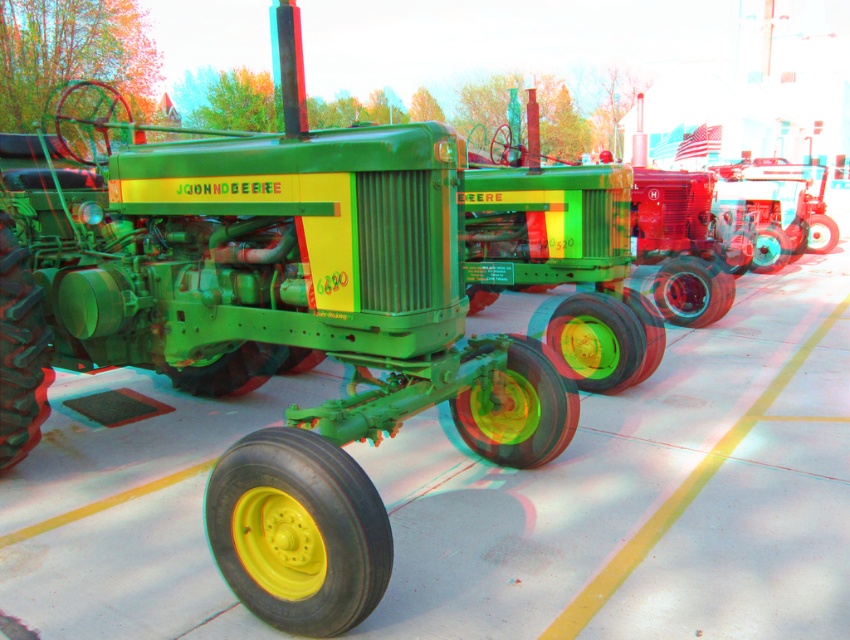
Who is more distant from viewer, (326, 593) or (843, 301)?

Point (843, 301)

From the picture: Who is positioned more to the right, green matte tractor at center or yellow rubber tire at center?

From the viewer's perspective, yellow rubber tire at center appears more on the right side.

This screenshot has height=640, width=850. Find the location of `green matte tractor at center`. green matte tractor at center is located at coordinates (264, 316).